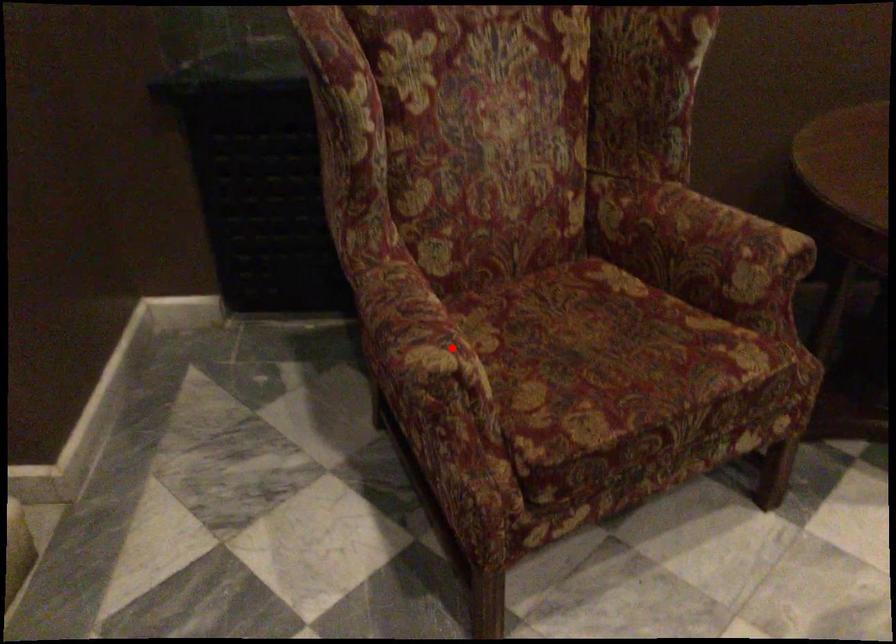
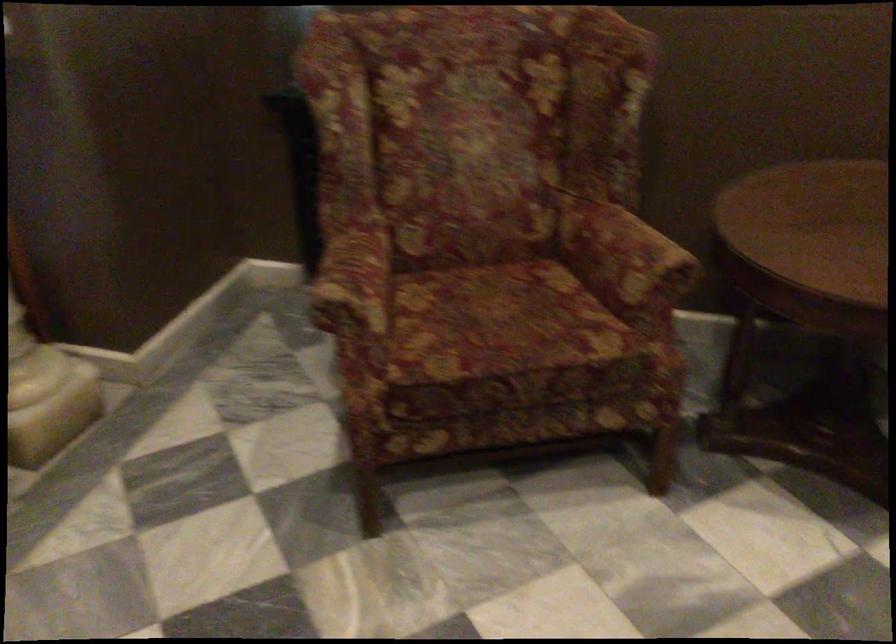
Find the pixel in the second image that matches the highlighted location in the first image.

(355, 286)